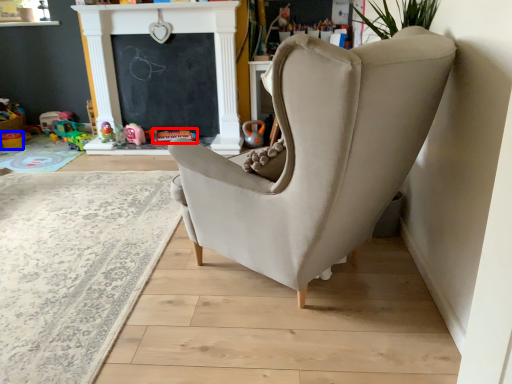
Question: Which object appears farthest to the camera in this image, toy (highlighted by a red box) or toy (highlighted by a blue box)?

Choices:
 (A) toy
 (B) toy

Answer: (B)